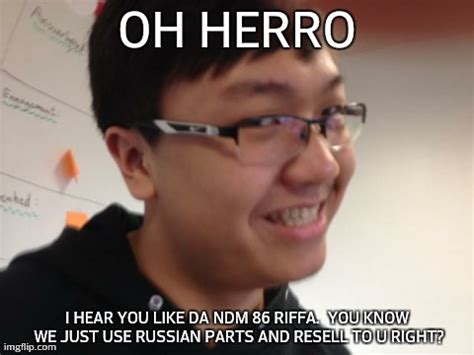
Where is `white board`? white board is located at coordinates (50, 175).